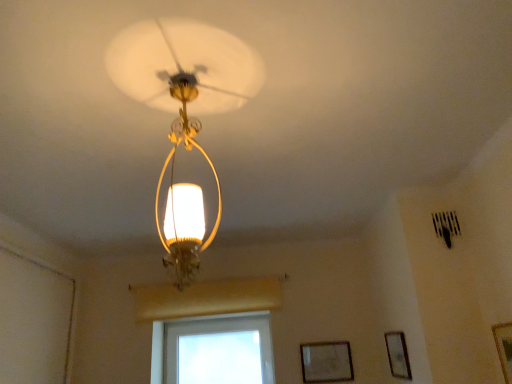
Question: Considering the relative positions of transparent glass window at center and wooden picture frame at lower right, positioned as the second picture frame in left-to-right order, in the image provided, is transparent glass window at center to the left of wooden picture frame at lower right, positioned as the second picture frame in left-to-right order, from the viewer's perspective?

Choices:
 (A) no
 (B) yes

Answer: (B)

Question: Does transparent glass window at center have a greater width compared to wooden picture frame at lower right, the second picture frame in the right-to-left sequence?

Choices:
 (A) yes
 (B) no

Answer: (A)

Question: Is transparent glass window at center positioned with its back to wooden picture frame at lower right, positioned as the second picture frame in left-to-right order?

Choices:
 (A) no
 (B) yes

Answer: (A)

Question: Considering the relative sizes of transparent glass window at center and wooden picture frame at lower right, positioned as the second picture frame in left-to-right order, in the image provided, is transparent glass window at center bigger than wooden picture frame at lower right, positioned as the second picture frame in left-to-right order,?

Choices:
 (A) no
 (B) yes

Answer: (B)

Question: Does transparent glass window at center have a lesser height compared to wooden picture frame at lower right, arranged as the 2th picture frame when viewed from the front?

Choices:
 (A) yes
 (B) no

Answer: (B)

Question: Considering the relative sizes of transparent glass window at center and wooden picture frame at lower right, the second picture frame in the right-to-left sequence, in the image provided, is transparent glass window at center taller than wooden picture frame at lower right, the second picture frame in the right-to-left sequence,?

Choices:
 (A) no
 (B) yes

Answer: (B)

Question: Considering the relative sizes of wooden framed picture at lower right, the 3th picture frame in the front-to-back sequence, and transparent glass window at center in the image provided, is wooden framed picture at lower right, the 3th picture frame in the front-to-back sequence, thinner than transparent glass window at center?

Choices:
 (A) yes
 (B) no

Answer: (A)

Question: Is wooden framed picture at lower right, the 3th picture frame in the front-to-back sequence, shorter than transparent glass window at center?

Choices:
 (A) yes
 (B) no

Answer: (A)

Question: Would you say wooden framed picture at lower right, which appears as the 1th picture frame when viewed from the left, is outside transparent glass window at center?

Choices:
 (A) yes
 (B) no

Answer: (A)

Question: Is wooden framed picture at lower right, the 3th picture frame in the front-to-back sequence, facing away from transparent glass window at center?

Choices:
 (A) yes
 (B) no

Answer: (B)

Question: Can you confirm if wooden framed picture at lower right, which appears as the 1th picture frame when viewed from the left, is wider than transparent glass window at center?

Choices:
 (A) no
 (B) yes

Answer: (A)

Question: From the image's perspective, is wooden framed picture at lower right, which appears as the 1th picture frame when viewed from the left, on transparent glass window at center?

Choices:
 (A) no
 (B) yes

Answer: (B)

Question: Considering the relative positions of wooden framed picture at lower right, placed as the third picture frame when sorted from right to left, and wooden picture frame at lower right, positioned as the second picture frame in left-to-right order, in the image provided, is wooden framed picture at lower right, placed as the third picture frame when sorted from right to left, to the right of wooden picture frame at lower right, positioned as the second picture frame in left-to-right order, from the viewer's perspective?

Choices:
 (A) yes
 (B) no

Answer: (B)